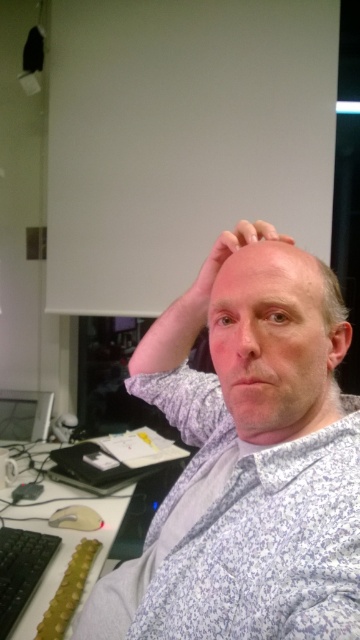
Question: Which object is the farthest from the white printed shirt at center?

Choices:
 (A) pink skin at center
 (B) matte black monitor at lower left
 (C) black plastic computer desk at lower left
 (D) black rubberized keyboard at lower left

Answer: (B)

Question: Does white printed shirt at center have a greater width compared to pink skin at center?

Choices:
 (A) no
 (B) yes

Answer: (B)

Question: Does smooth bald head at upper center appear under matte black monitor at lower left?

Choices:
 (A) yes
 (B) no

Answer: (B)

Question: Which point appears farthest from the camera in this image?

Choices:
 (A) (15, 406)
 (B) (249, 282)

Answer: (A)

Question: Does bald head at center have a lesser width compared to black rubberized keyboard at lower left?

Choices:
 (A) no
 (B) yes

Answer: (A)

Question: Which point is farther from the camera taking this photo?

Choices:
 (A) (3, 637)
 (B) (6, 440)
 (C) (240, 294)

Answer: (B)